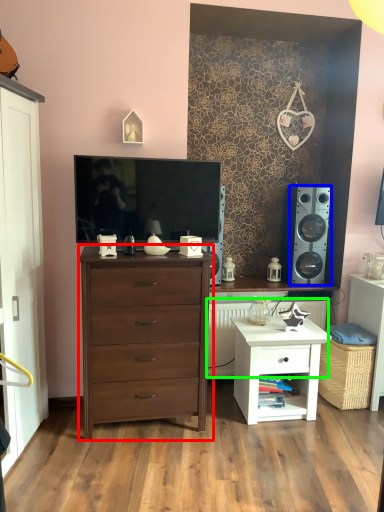
Question: Which object is the farthest from chest of drawers (highlighted by a red box)? Choose among these: speaker (highlighted by a blue box) or radiator (highlighted by a green box).

Choices:
 (A) speaker
 (B) radiator

Answer: (A)